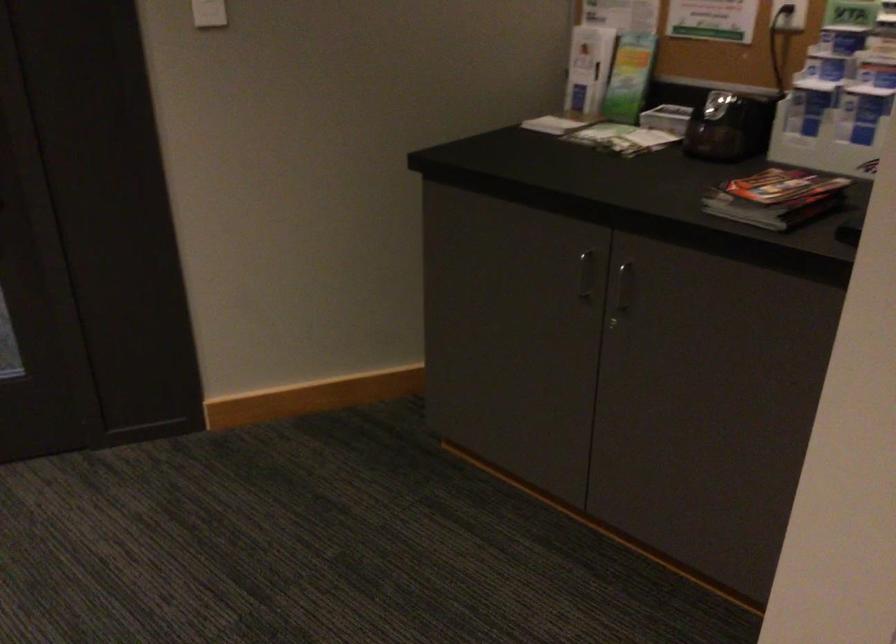
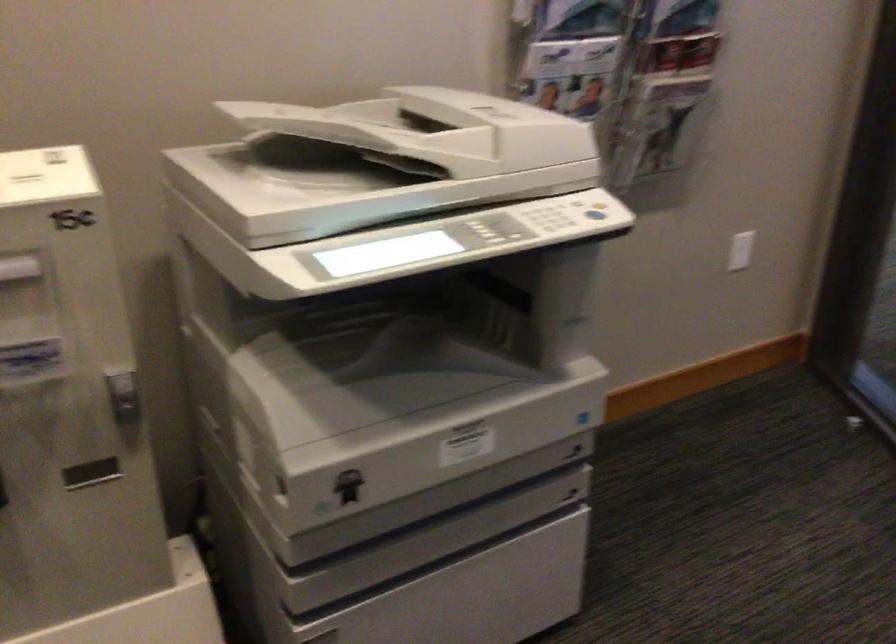
The first image is from the beginning of the video and the second image is from the end. How did the camera likely rotate when shooting the video?

The camera rotated toward left-down.